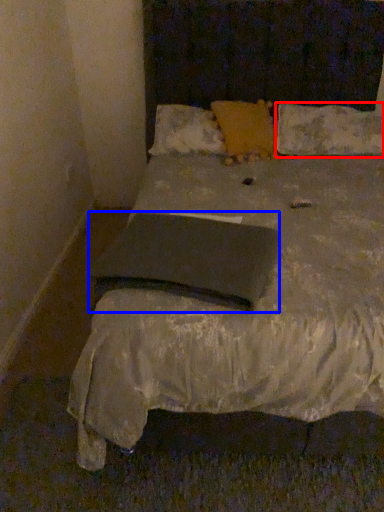
Question: Which point is further to the camera, pillow (highlighted by a red box) or pad (highlighted by a blue box)?

Choices:
 (A) pillow
 (B) pad

Answer: (A)